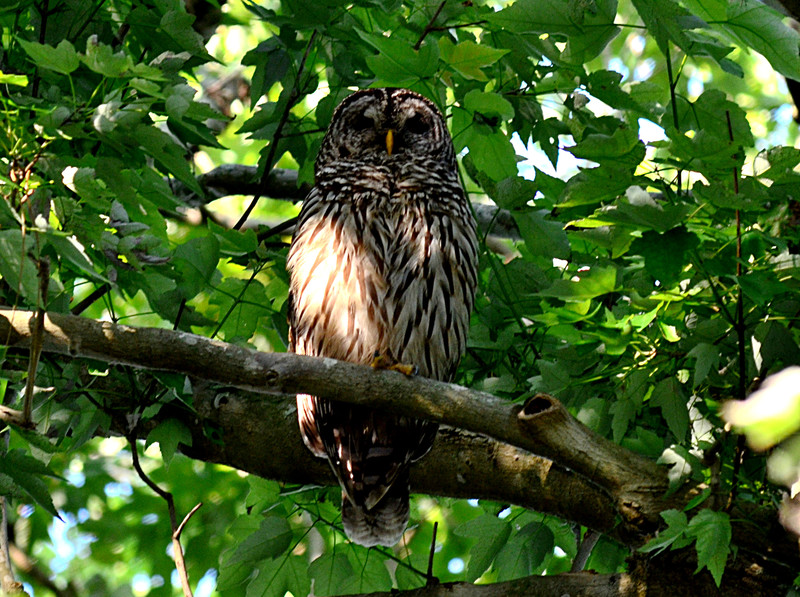
Where is `chest`? Image resolution: width=800 pixels, height=597 pixels. chest is located at coordinates (382, 281).